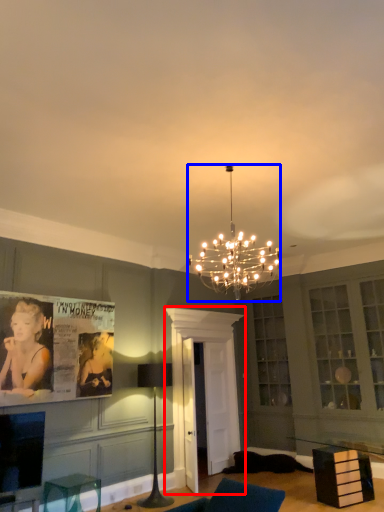
Question: Which of the following is the closest to the observer, glass door (highlighted by a red box) or lamp (highlighted by a blue box)?

Choices:
 (A) glass door
 (B) lamp

Answer: (B)